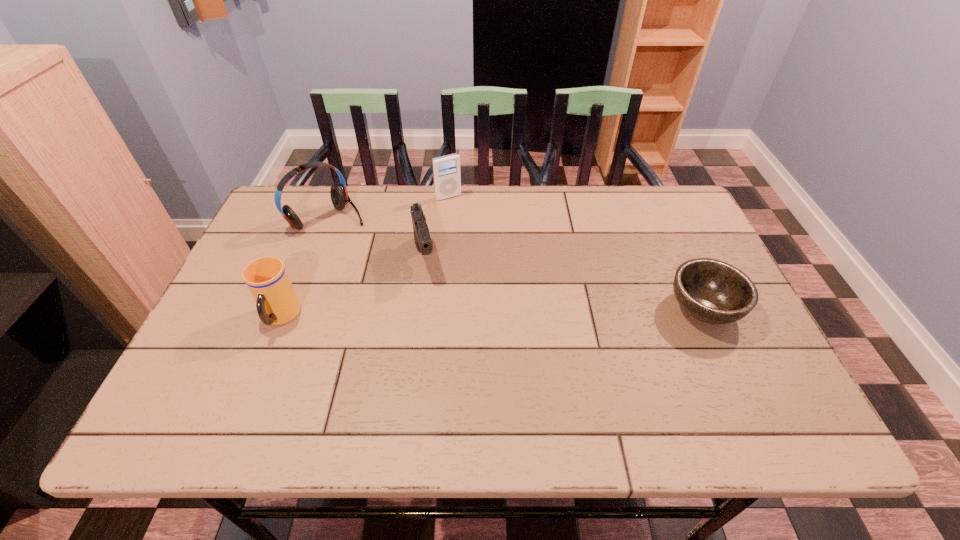
In order to click on the fourth closest object to the pistol in this screenshot , I will do `click(712, 291)`.